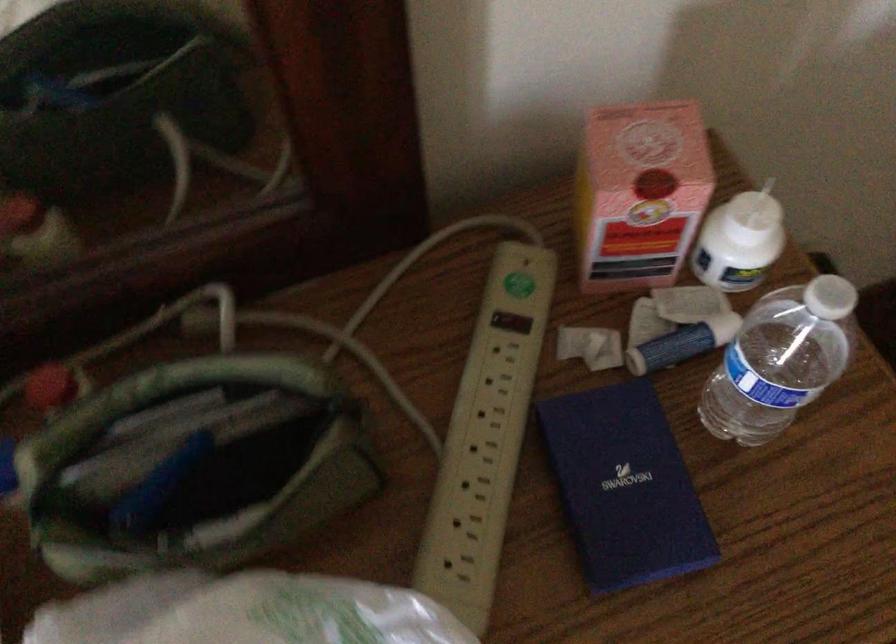
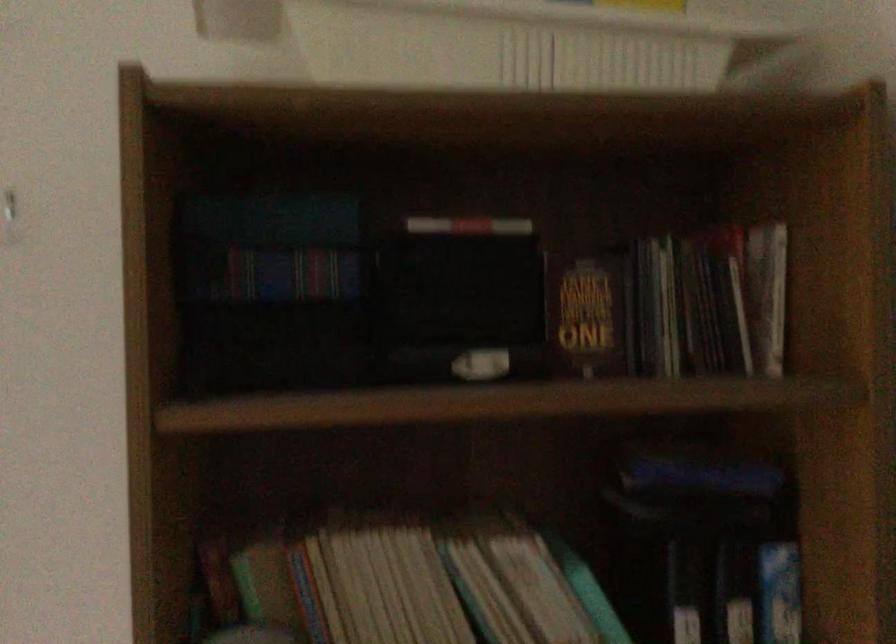
Question: Based on the continuous images, in which direction is the camera rotating? Reply with the corresponding letter.

Choices:
 (A) Left
 (B) Right
 (C) Up
 (D) Down

Answer: (A)